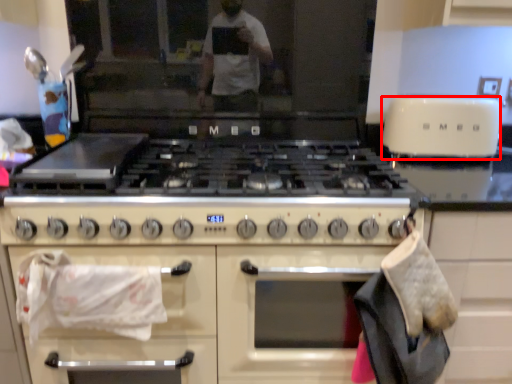
Question: From the image's perspective, where is toaster (annotated by the red box) located relative to cabinetry?

Choices:
 (A) below
 (B) above

Answer: (B)